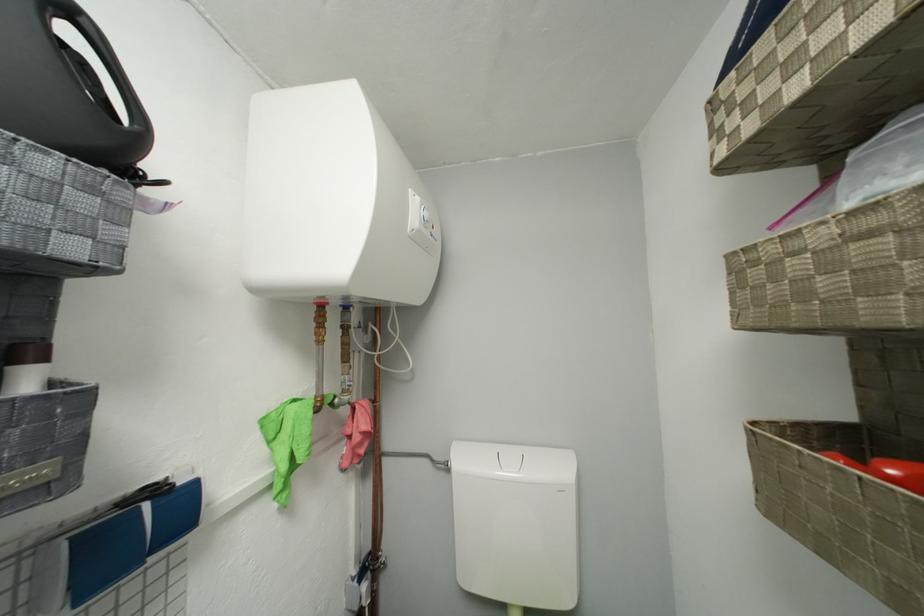
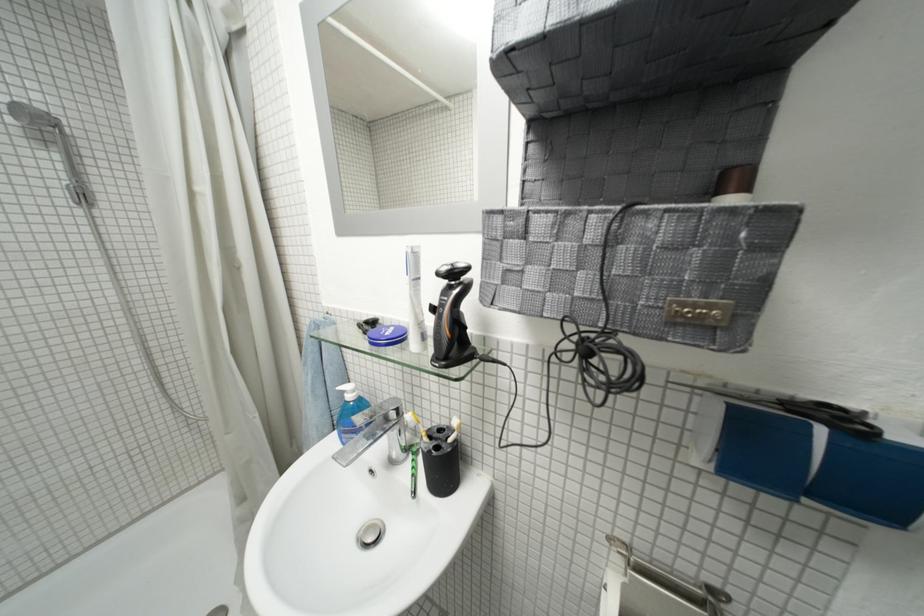
Question: The camera is either moving clockwise (left) or counter-clockwise (right) around the object. The first image is from the beginning of the video and the second image is from the end. Is the camera moving left or right when shooting the video?

Choices:
 (A) Left
 (B) Right

Answer: (B)